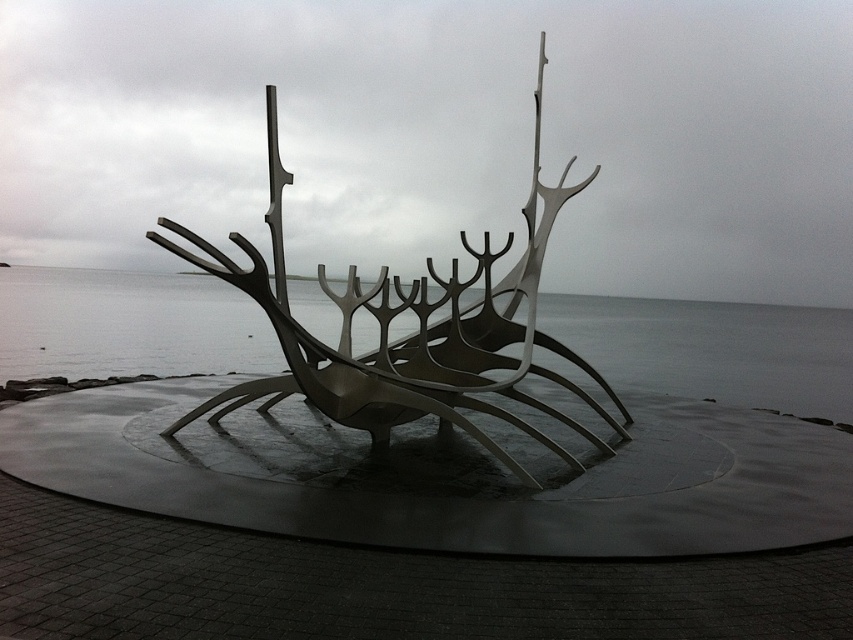
You are an art critic evaluating the sculpture. Based on the description, which object among the gray metallic water at center and the metallic silver ship at center is taller?

The metallic silver ship at center is taller than the gray metallic water at center.

You are standing at the base of the sculpture and want to take a photo of the point at coordinate point (811, 380). The camera you are using has a maximum focus range of 10 meters. Will the camera be able to focus on the point?

The distance of point (811, 380) from the camera is 9.45 meters, which is within the camera maximum focus range of 10 meters. Therefore, the camera can focus on the point.

You are standing on the circular platform where the sculpture is mounted. Looking out towards the gray metallic water at center, which is represented by the point at coordinates (712, 349), can you determine the direction you should face to look directly at the water?

The gray metallic water at center is located at coordinates (712, 349), so you should face towards the center of the sculpture to look directly at it.